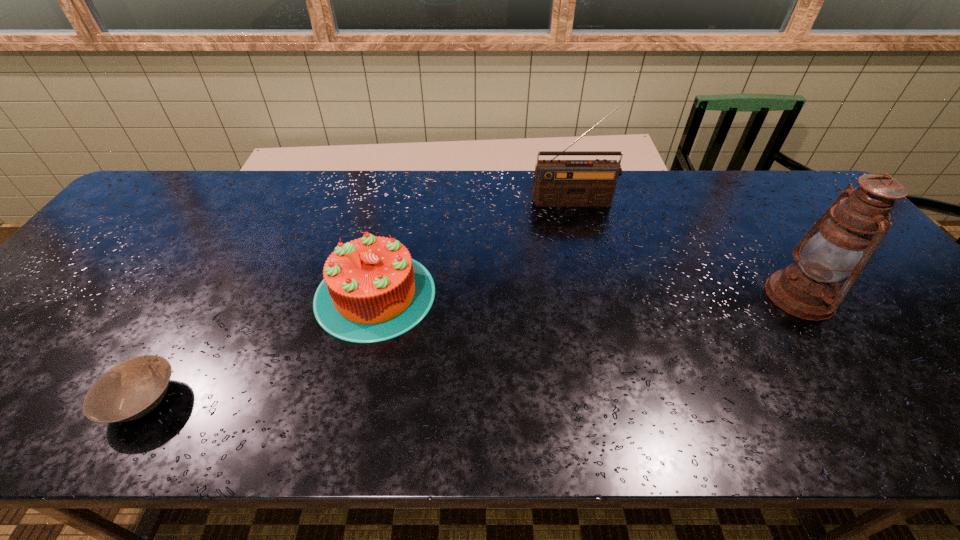
Locate an element on the screen. empty space between the radio receiver and the rightmost object is located at coordinates (688, 248).

Where is `free area in between the third object from right to left and the shortest object`? The height and width of the screenshot is (540, 960). free area in between the third object from right to left and the shortest object is located at coordinates (259, 347).

Where is `the second closest object to the farthest object`? The width and height of the screenshot is (960, 540). the second closest object to the farthest object is located at coordinates (860, 218).

Locate which object is the second closest to the rightmost object. Please provide its 2D coordinates. Your answer should be formatted as a tuple, i.e. [(x, y)], where the tuple contains the x and y coordinates of a point satisfying the conditions above.

[(372, 291)]

Where is `free space that satisfies the following two spatial constraints: 1. on the front-facing side of the second object from right to left; 2. on the right side of the rightmost object`? This screenshot has width=960, height=540. free space that satisfies the following two spatial constraints: 1. on the front-facing side of the second object from right to left; 2. on the right side of the rightmost object is located at coordinates (601, 296).